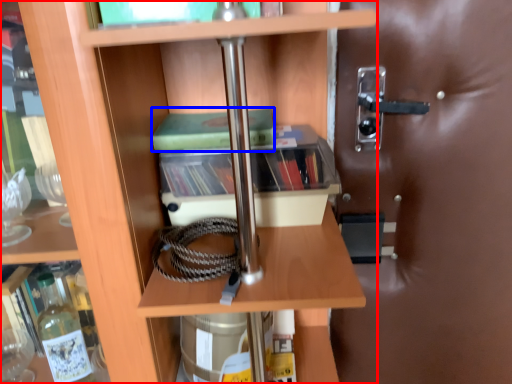
Question: Which object is further to the camera taking this photo, shelf (highlighted by a red box) or paperback book (highlighted by a blue box)?

Choices:
 (A) shelf
 (B) paperback book

Answer: (B)